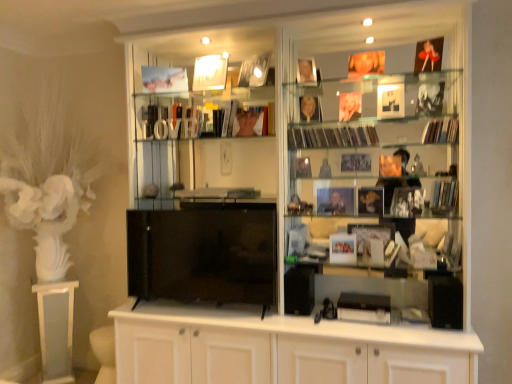
What are the coordinates of `empty space that is ontop of shiny plastic magazines at center right, which is counted as the fourth magazine, starting from the bottom (from a real-world perspective)` in the screenshot? It's located at (329, 120).